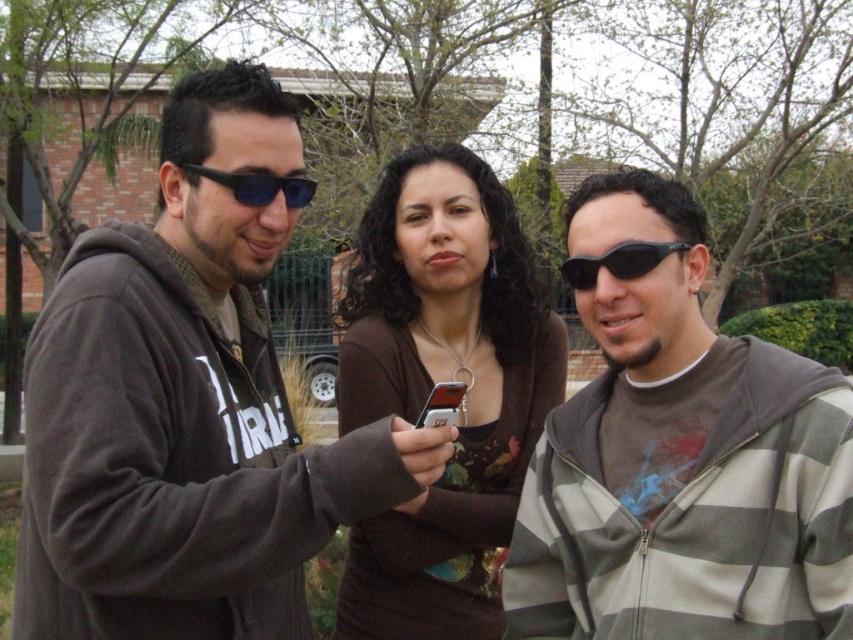
You are standing in front of the three people in the image. You want to hand a gift to the person wearing the striped hoodie at center without disturbing the person in the matte brown sweater at center. Which direction should you approach from?

You should approach from the direction of the striped hoodie at center since it is closer to the viewer than the matte brown sweater at center, allowing you to reach them without getting too close to the other person.

In the scene shown: You are a photographer trying to capture a candid shot of the striped hoodie at center and the matte brown sweater at center. Based on their positions, which one would be easier to frame in your camera without moving your position?

The striped hoodie at center is located below the matte brown sweater at center, so it might be easier to frame the matte brown sweater at center in the camera since it is higher up and more visible from your current position.

Please provide the exact coordinates of the black plastic sunglasses at center in the image, using the coordinate system where the bottom left corner is the origin point.

The black plastic sunglasses at center are located at coordinates point (x=618, y=262).